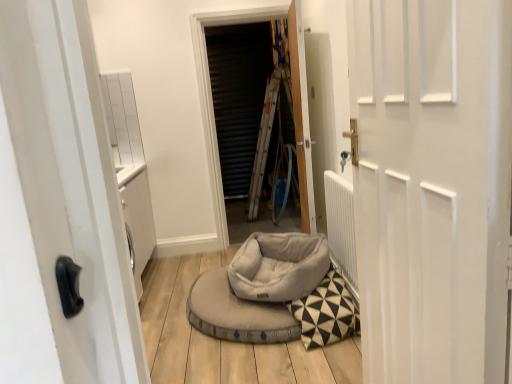
Question: Looking at their shapes, would you say metallic silver screen at center is wider or thinner than soft gray fabric bean bag at center?

Choices:
 (A) wide
 (B) thin

Answer: (B)

Question: Considering the positions of metallic silver screen at center and soft gray fabric bean bag at center in the image, is metallic silver screen at center taller or shorter than soft gray fabric bean bag at center?

Choices:
 (A) tall
 (B) short

Answer: (A)

Question: Based on their relative distances, which object is nearer to the metallic silver screen at center?

Choices:
 (A) soft gray fabric bean bag at center
 (B) wooden door at center, the first door viewed from the back
 (C) white matte door at center, which is counted as the 1th door, starting from the front

Answer: (B)

Question: Based on their relative distances, which object is farther from the soft gray fabric bean bag at center?

Choices:
 (A) white matte door at center, which is counted as the 1th door, starting from the front
 (B) metallic silver screen at center
 (C) wooden door at center, the first door viewed from the back

Answer: (B)